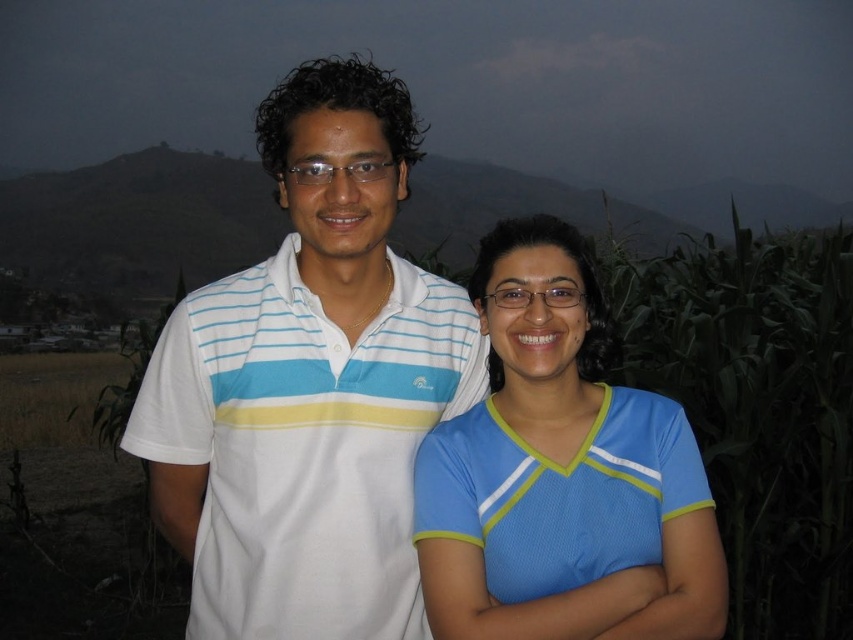
You are trying to decide which shirt to wear for a casual evening walk. Both the white striped polo shirt at center and the blue mesh shirt at center are options. If you want the shirt that takes up more visual space, which one should you choose?

The white striped polo shirt at center is bigger than the blue mesh shirt at center, so you should choose the white striped polo shirt at center as it takes up more visual space.

Looking at this image, you are a photographer trying to capture the two people in the image. You want to focus on the point at coordinates point (x=309, y=385). Which clothing item from the two people should you adjust your focus to ensure the point is in sharp detail?

The point (x=309, y=385) is on the white striped polo shirt at center, so you should focus on the white striped polo shirt at center to ensure the point is in sharp detail.